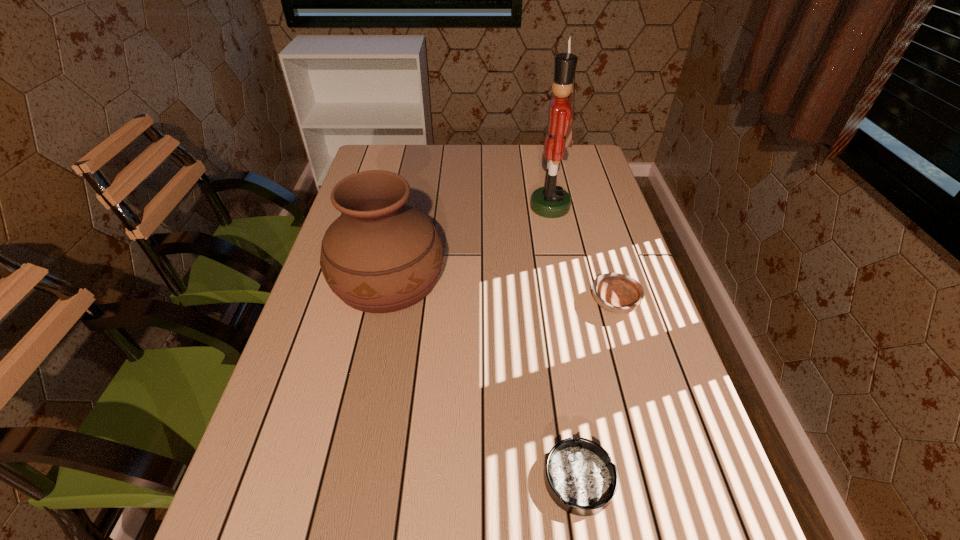
Identify the location of empty space between the nearest object and the farthest object. The width and height of the screenshot is (960, 540). (564, 343).

Locate an element on the screen. free spot between the nutcracker and the second tallest object is located at coordinates (468, 243).

The width and height of the screenshot is (960, 540). I want to click on vacant area that lies between the tallest object and the nearest object, so click(x=564, y=343).

Where is `empty location between the tallest object and the shortest object`? empty location between the tallest object and the shortest object is located at coordinates (564, 343).

Find the location of a particular element. The image size is (960, 540). free space between the nutcracker and the ashtray is located at coordinates (564, 343).

Where is `vacant space in between the third shortest object and the ashtray`? vacant space in between the third shortest object and the ashtray is located at coordinates (483, 380).

Locate an element on the screen. The image size is (960, 540). unoccupied area between the bowl and the ashtray is located at coordinates (596, 392).

Locate an element on the screen. The height and width of the screenshot is (540, 960). free spot between the bowl and the nearest object is located at coordinates 596,392.

At what (x,y) coordinates should I click in order to perform the action: click on free space between the bowl and the second tallest object. Please return your answer as a coordinate pair (x, y). The width and height of the screenshot is (960, 540). Looking at the image, I should click on (501, 292).

Select which object appears as the closest to the second shortest object. Please provide its 2D coordinates. Your answer should be formatted as a tuple, i.e. [(x, y)], where the tuple contains the x and y coordinates of a point satisfying the conditions above.

[(551, 201)]